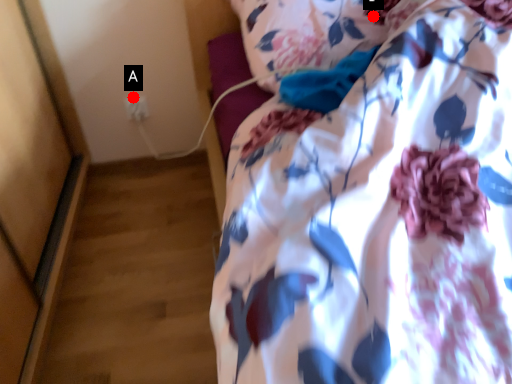
Question: Two points are circled on the image, labeled by A and B beside each circle. Which point is further to the camera?

Choices:
 (A) A is further
 (B) B is further

Answer: (A)